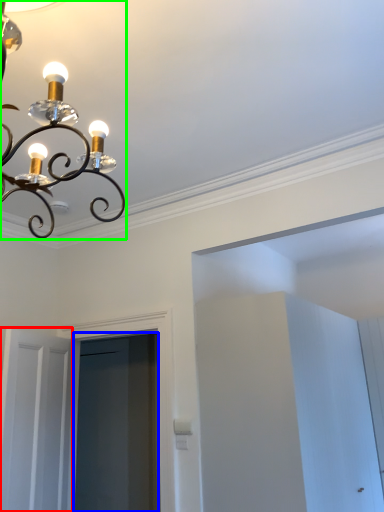
Question: Estimate the real-world distances between objects in this image. Which object is farther from door (highlighted by a red box), screen door (highlighted by a blue box) or lamp (highlighted by a green box)?

Choices:
 (A) screen door
 (B) lamp

Answer: (B)